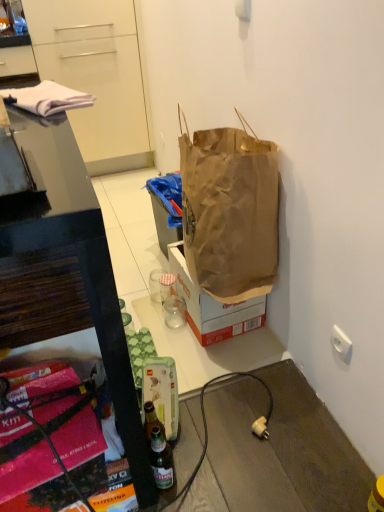
What is the approximate height of white glossy cabinet at upper left?

The height of white glossy cabinet at upper left is 1.10 meters.

The height and width of the screenshot is (512, 384). In order to click on clear glass cup at center, which appears as the second coffee cup when viewed from the front in this screenshot , I will do `click(155, 284)`.

Describe the element at coordinates (229, 212) in the screenshot. I see `brown paper bag at center` at that location.

Describe the element at coordinates (47, 98) in the screenshot. Image resolution: width=384 pixels, height=512 pixels. I see `white cloth at upper left` at that location.

Describe the element at coordinates (213, 306) in the screenshot. I see `brown paper bag at center` at that location.

At what (x,y) coordinates should I click in order to perform the action: click on white plastic power outlet at lower right. Please return your answer as a coordinate pair (x, y). Image resolution: width=384 pixels, height=512 pixels. Looking at the image, I should click on (260, 428).

Locate an element on the screen. This screenshot has height=512, width=384. white glossy cabinet at upper left is located at coordinates (96, 76).

Is brown paper bag at center next to white glossy cabinet at upper left?

No, brown paper bag at center is not with white glossy cabinet at upper left.

Considering the positions of points (210, 308) and (90, 80), is point (210, 308) farther from camera compared to point (90, 80)?

No, (210, 308) is closer to viewer.

Does brown paper bag at center turn towards white glossy cabinet at upper left?

No, brown paper bag at center does not turn towards white glossy cabinet at upper left.

Which is correct: brown paper bag at center is inside white glossy cabinet at upper left, or outside of it?

brown paper bag at center lies outside white glossy cabinet at upper left.

Measure the distance between brown paper bag at center and clear glass cup at center, which is counted as the first coffee cup, starting from the back.

brown paper bag at center and clear glass cup at center, which is counted as the first coffee cup, starting from the back, are 12.97 inches apart from each other.

The width and height of the screenshot is (384, 512). I want to click on the 1st coffee cup below the brown paper bag at center (from the image's perspective), so click(155, 284).

Is brown paper bag at center facing towards clear glass cup at center, which appears as the second coffee cup when viewed from the front?

Yes.

Considering the relative positions of brown paper bag at center and clear glass cup at center, which is counted as the first coffee cup, starting from the back, in the image provided, is brown paper bag at center to the left of clear glass cup at center, which is counted as the first coffee cup, starting from the back, from the viewer's perspective?

In fact, brown paper bag at center is to the right of clear glass cup at center, which is counted as the first coffee cup, starting from the back.

Which of these two, brown paper bag at center or clear glass cup at center, which appears as the second coffee cup when viewed from the front, stands shorter?

clear glass cup at center, which appears as the second coffee cup when viewed from the front, is shorter.

From a real-world perspective, is brown paper bag at center located higher than clear glass cup at center, which appears as the second coffee cup when viewed from the front?

Yes.

Which is more to the left, brown paper bag at center or clear glass cup at center, which is counted as the first coffee cup, starting from the back?

clear glass cup at center, which is counted as the first coffee cup, starting from the back.

Image resolution: width=384 pixels, height=512 pixels. In the image, there is a clear glass cup at center, which is counted as the first coffee cup, starting from the back. Find the location of `handbag above it (from the image's perspective)`. handbag above it (from the image's perspective) is located at coordinates (229, 212).

How many degrees apart are the facing directions of transparent glass at center, positioned as the first coffee cup in front-to-back order, and clear glass cup at center, which is counted as the first coffee cup, starting from the back?

There is a 0.00234-degree angle between the facing directions of transparent glass at center, positioned as the first coffee cup in front-to-back order, and clear glass cup at center, which is counted as the first coffee cup, starting from the back.

Is transparent glass at center, arranged as the second coffee cup when viewed from the back, at the right side of clear glass cup at center, which is counted as the first coffee cup, starting from the back?

Correct, you'll find transparent glass at center, arranged as the second coffee cup when viewed from the back, to the right of clear glass cup at center, which is counted as the first coffee cup, starting from the back.

Between transparent glass at center, positioned as the first coffee cup in front-to-back order, and clear glass cup at center, which appears as the second coffee cup when viewed from the front, which one has larger width?

clear glass cup at center, which appears as the second coffee cup when viewed from the front, is wider.

Measure the distance between transparent glass at center, arranged as the second coffee cup when viewed from the back, and clear glass cup at center, which is counted as the first coffee cup, starting from the back.

transparent glass at center, arranged as the second coffee cup when viewed from the back, is 4.03 inches from clear glass cup at center, which is counted as the first coffee cup, starting from the back.

From a real-world perspective, who is located lower, white glossy cabinet at upper left or clear glass cup at center, which is counted as the first coffee cup, starting from the back?

clear glass cup at center, which is counted as the first coffee cup, starting from the back, from a real-world perspective.

Based on their sizes in the image, would you say white glossy cabinet at upper left is bigger or smaller than clear glass cup at center, which appears as the second coffee cup when viewed from the front?

In the image, white glossy cabinet at upper left appears to be larger than clear glass cup at center, which appears as the second coffee cup when viewed from the front.

Is white glossy cabinet at upper left thinner than clear glass cup at center, which is counted as the first coffee cup, starting from the back?

No.

Does clear glass cup at center, which is counted as the first coffee cup, starting from the back, contain white plastic power outlet at lower right?

No, white plastic power outlet at lower right is not a part of clear glass cup at center, which is counted as the first coffee cup, starting from the back.

Is clear glass cup at center, which appears as the second coffee cup when viewed from the front, aimed at white plastic power outlet at lower right?

No.

Considering the positions of points (155, 276) and (262, 432), is point (155, 276) farther from camera compared to point (262, 432)?

Yes, point (155, 276) is behind point (262, 432).

Where is `power outlet below the clear glass cup at center, which is counted as the first coffee cup, starting from the back (from the image's perspective)`? power outlet below the clear glass cup at center, which is counted as the first coffee cup, starting from the back (from the image's perspective) is located at coordinates (260, 428).

Is brown paper bag at center not near white cloth at upper left?

No, brown paper bag at center is not far from white cloth at upper left.

You are a GUI agent. You are given a task and a screenshot of the screen. Output one action in this format:
    pyautogui.click(x=<x>, y=<y>)
    Task: Click on the box located underneath the white cloth at upper left (from a real-world perspective)
    This screenshot has width=384, height=512.
    Given the screenshot: What is the action you would take?
    pyautogui.click(x=213, y=306)

Is point (247, 315) closer or farther from the camera than point (78, 95)?

Point (247, 315) is positioned farther from the camera compared to point (78, 95).

The width and height of the screenshot is (384, 512). I want to click on box in front of the white glossy cabinet at upper left, so click(x=213, y=306).

There is a clear glass cup at center, which appears as the second coffee cup when viewed from the front. Identify the location of box above it (from a real-world perspective). The width and height of the screenshot is (384, 512). [213, 306].

Estimate the real-world distances between objects in this image. Which object is closer to white cloth at upper left, clear glass cup at center, which appears as the second coffee cup when viewed from the front, or transparent glass at center, arranged as the second coffee cup when viewed from the back?

Among the two, transparent glass at center, arranged as the second coffee cup when viewed from the back, is located nearer to white cloth at upper left.

Considering their positions, is white glossy cabinet at upper left positioned closer to brown paper bag at center than white plastic power outlet at lower right?

Based on the image, white plastic power outlet at lower right appears to be nearer to brown paper bag at center.

Estimate the real-world distances between objects in this image. Which object is further from white cloth at upper left, brown paper bag at center or white glossy cabinet at upper left?

white glossy cabinet at upper left lies further to white cloth at upper left than the other object.

In the scene shown: Considering their positions, is clear glass cup at center, which appears as the second coffee cup when viewed from the front, positioned further to white glossy cabinet at upper left than brown paper bag at center?

brown paper bag at center is further to white glossy cabinet at upper left.

Based on their spatial positions, is clear glass cup at center, which appears as the second coffee cup when viewed from the front, or white plastic power outlet at lower right further from transparent glass at center, positioned as the first coffee cup in front-to-back order?

Among the two, white plastic power outlet at lower right is located further to transparent glass at center, positioned as the first coffee cup in front-to-back order.

Estimate the real-world distances between objects in this image. Which object is closer to brown paper bag at center, transparent glass at center, positioned as the first coffee cup in front-to-back order, or clear glass cup at center, which appears as the second coffee cup when viewed from the front?

The object closer to brown paper bag at center is transparent glass at center, positioned as the first coffee cup in front-to-back order.

Considering their positions, is clear glass cup at center, which is counted as the first coffee cup, starting from the back, positioned closer to brown paper bag at center than white cloth at upper left?

white cloth at upper left is closer to brown paper bag at center.

Looking at the image, which one is located further to clear glass cup at center, which appears as the second coffee cup when viewed from the front, brown paper bag at center or brown paper bag at center?

Among the two, brown paper bag at center is located further to clear glass cup at center, which appears as the second coffee cup when viewed from the front.

Identify the location of box between white cloth at upper left and white plastic power outlet at lower right in the vertical direction. The width and height of the screenshot is (384, 512). (213, 306).

Where is `box between brown paper bag at center and white plastic power outlet at lower right vertically`? The width and height of the screenshot is (384, 512). box between brown paper bag at center and white plastic power outlet at lower right vertically is located at coordinates (213, 306).

The height and width of the screenshot is (512, 384). Find the location of `box between white glossy cabinet at upper left and transparent glass at center, positioned as the first coffee cup in front-to-back order, from top to bottom`. box between white glossy cabinet at upper left and transparent glass at center, positioned as the first coffee cup in front-to-back order, from top to bottom is located at coordinates (213, 306).

At what (x,y) coordinates should I click in order to perform the action: click on handbag between white cloth at upper left and white plastic power outlet at lower right vertically. Please return your answer as a coordinate pair (x, y). The height and width of the screenshot is (512, 384). Looking at the image, I should click on (229, 212).